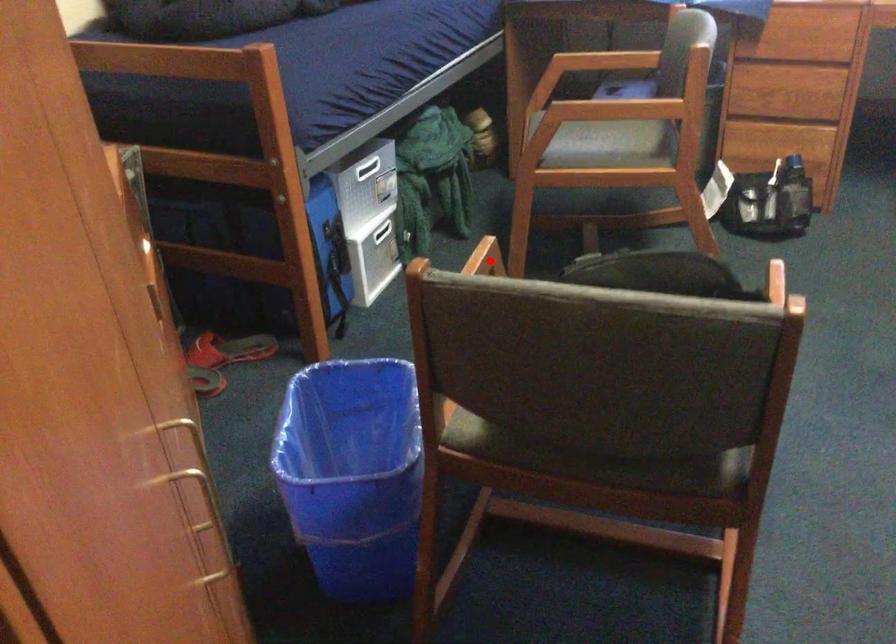
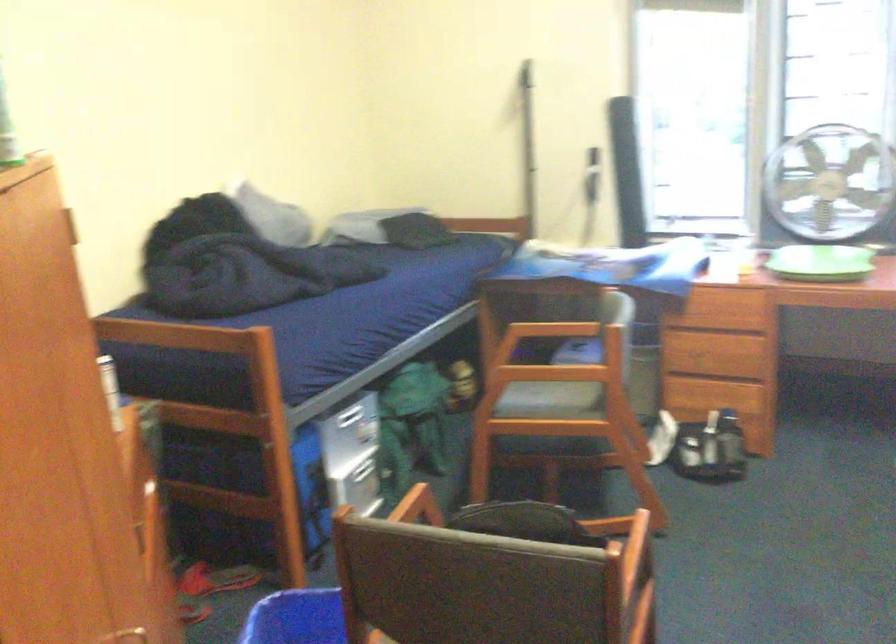
Question: I am providing you with two images of the same scene from different viewpoints. A red point is shown in image1. For the corresponding object point in image2, is it positioned nearer or farther from the camera?

Choices:
 (A) Nearer
 (B) Farther

Answer: (B)